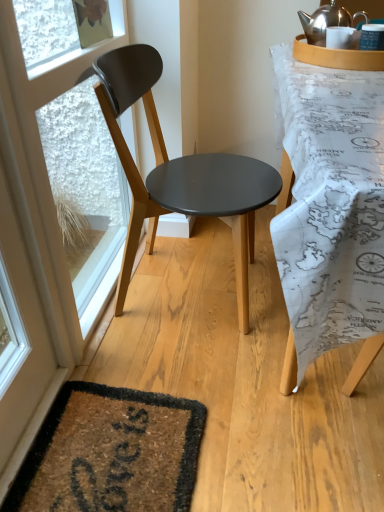
Locate an element on the screen. The height and width of the screenshot is (512, 384). matte black chair at center is located at coordinates (179, 172).

The image size is (384, 512). Describe the element at coordinates (70, 136) in the screenshot. I see `white plastic window frame at left` at that location.

This screenshot has width=384, height=512. I want to click on polished silver kettle at upper right, so click(327, 21).

Looking at the image, does map-patterned fabric at right seem bigger or smaller compared to polished silver kettle at upper right?

In the image, map-patterned fabric at right appears to be larger than polished silver kettle at upper right.

Does map-patterned fabric at right have a lesser width compared to polished silver kettle at upper right?

No.

Which of these two, map-patterned fabric at right or polished silver kettle at upper right, stands taller?

With more height is map-patterned fabric at right.

Is map-patterned fabric at right in front of or behind polished silver kettle at upper right in the image?

map-patterned fabric at right is in front of polished silver kettle at upper right.

Is polished silver kettle at upper right bigger or smaller than matte black chair at center?

polished silver kettle at upper right is smaller than matte black chair at center.

Is polished silver kettle at upper right located outside matte black chair at center?

That's correct, polished silver kettle at upper right is outside of matte black chair at center.

From the image's perspective, between polished silver kettle at upper right and matte black chair at center, which one is located above?

polished silver kettle at upper right.

Considering the sizes of polished silver kettle at upper right and white plastic window frame at left in the image, is polished silver kettle at upper right taller or shorter than white plastic window frame at left?

In the image, polished silver kettle at upper right appears to be shorter than white plastic window frame at left.

Considering the relative positions of polished silver kettle at upper right and white plastic window frame at left in the image provided, is polished silver kettle at upper right in front of white plastic window frame at left?

No, polished silver kettle at upper right is behind white plastic window frame at left.

Is polished silver kettle at upper right with white plastic window frame at left?

polished silver kettle at upper right is not next to white plastic window frame at left, and they're not touching.

From the image's perspective, which one is positioned higher, polished silver kettle at upper right or white plastic window frame at left?

polished silver kettle at upper right is shown above in the image.

Measure the distance from white plastic window frame at left to map-patterned fabric at right.

30.45 inches.

Which point is more distant from viewer, (65, 250) or (368, 191)?

The point (65, 250) is farther from the camera.

From the image's perspective, is white plastic window frame at left located beneath map-patterned fabric at right?

Indeed, from the image's perspective, white plastic window frame at left is shown beneath map-patterned fabric at right.

Considering the sizes of objects white plastic window frame at left and map-patterned fabric at right in the image provided, who is thinner, white plastic window frame at left or map-patterned fabric at right?

With smaller width is white plastic window frame at left.

From the picture: Can you tell me how much matte black chair at center and map-patterned fabric at right differ in facing direction?

matte black chair at center and map-patterned fabric at right are facing 4.29 degrees away from each other.

Can you confirm if matte black chair at center is smaller than map-patterned fabric at right?

Yes.

Is point (192, 162) positioned before point (340, 320)?

No, it is not.

From a real-world perspective, does map-patterned fabric at right sit lower than matte black chair at center?

Yes, from a real-world perspective, map-patterned fabric at right is below matte black chair at center.

Measure the distance between map-patterned fabric at right and matte black chair at center.

map-patterned fabric at right is 18.91 inches from matte black chair at center.

Which is in front, map-patterned fabric at right or matte black chair at center?

map-patterned fabric at right is more forward.

In terms of width, does matte black chair at center look wider or thinner when compared to white plastic window frame at left?

Considering their sizes, matte black chair at center looks broader than white plastic window frame at left.

Is point (163, 153) positioned before point (61, 248)?

That is False.

The image size is (384, 512). Find the location of `chair in front of the white plastic window frame at left`. chair in front of the white plastic window frame at left is located at coordinates (179, 172).

Considering the sizes of matte black chair at center and white plastic window frame at left in the image, is matte black chair at center taller or shorter than white plastic window frame at left?

matte black chair at center is taller than white plastic window frame at left.

The width and height of the screenshot is (384, 512). In order to click on desk on the right of polished silver kettle at upper right in this screenshot , I will do `click(330, 213)`.

At what (x,y) coordinates should I click in order to perform the action: click on chair below the polished silver kettle at upper right (from the image's perspective). Please return your answer as a coordinate pair (x, y). Image resolution: width=384 pixels, height=512 pixels. Looking at the image, I should click on (179, 172).

Which object lies nearer to the anchor point polished silver kettle at upper right, white plastic window frame at left or map-patterned fabric at right?

Among the two, map-patterned fabric at right is located nearer to polished silver kettle at upper right.

Consider the image. Considering their positions, is matte black chair at center positioned closer to map-patterned fabric at right than white plastic window frame at left?

Among the two, matte black chair at center is located nearer to map-patterned fabric at right.

From the image, which object appears to be nearer to map-patterned fabric at right, polished silver kettle at upper right or white plastic window frame at left?

polished silver kettle at upper right is positioned closer to the anchor map-patterned fabric at right.

When comparing their distances from map-patterned fabric at right, does white plastic window frame at left or matte black chair at center seem further?

Among the two, white plastic window frame at left is located further to map-patterned fabric at right.

Looking at the image, which one is located further to white plastic window frame at left, polished silver kettle at upper right or matte black chair at center?

polished silver kettle at upper right is positioned further to the anchor white plastic window frame at left.

From the image, which object appears to be nearer to map-patterned fabric at right, matte black chair at center or polished silver kettle at upper right?

Based on the image, matte black chair at center appears to be nearer to map-patterned fabric at right.

Looking at this image, looking at the image, which one is located closer to white plastic window frame at left, polished silver kettle at upper right or map-patterned fabric at right?

The object closer to white plastic window frame at left is map-patterned fabric at right.

From the image, which object appears to be farther from map-patterned fabric at right, polished silver kettle at upper right or matte black chair at center?

polished silver kettle at upper right is further to map-patterned fabric at right.

In order to click on chair between white plastic window frame at left and polished silver kettle at upper right in this screenshot , I will do `click(179, 172)`.

You are a GUI agent. You are given a task and a screenshot of the screen. Output one action in this format:
    pyautogui.click(x=<x>, y=<y>)
    Task: Click on the chair between white plastic window frame at left and map-patterned fabric at right from left to right
    This screenshot has height=512, width=384.
    Given the screenshot: What is the action you would take?
    pyautogui.click(x=179, y=172)

Identify the location of kettle between white plastic window frame at left and map-patterned fabric at right in the horizontal direction. (327, 21).

I want to click on chair located between map-patterned fabric at right and polished silver kettle at upper right in the depth direction, so click(179, 172).